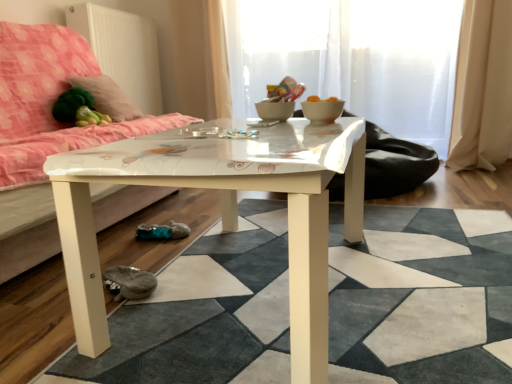
Locate an element on the screen. This screenshot has width=512, height=384. free space in front of beige fabric curtain at right is located at coordinates (489, 175).